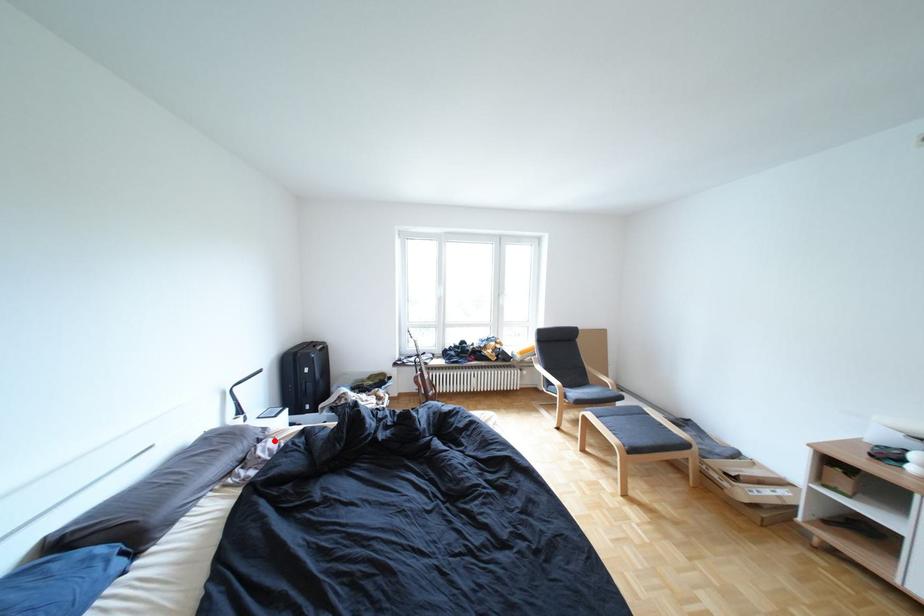
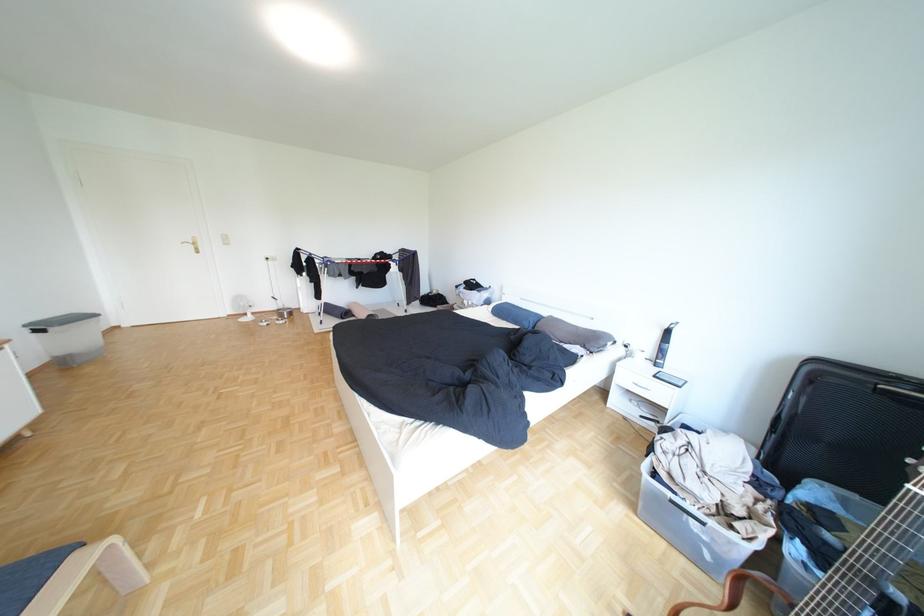
Question: I am providing you with two images of the same scene from different viewpoints. Given a red point in image1, look at the same physical point in image2. Is it:

Choices:
 (A) Closer to the viewpoint
 (B) Farther from the viewpoint

Answer: (B)